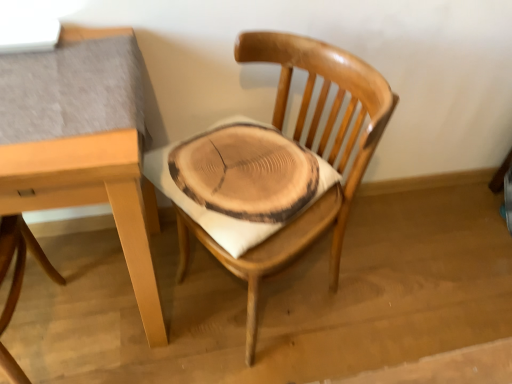
This screenshot has width=512, height=384. Describe the element at coordinates (274, 167) in the screenshot. I see `wooden chair at center, placed as the 1th chair when sorted from right to left` at that location.

This screenshot has width=512, height=384. What do you see at coordinates (19, 260) in the screenshot?
I see `natural wood chair at center, positioned as the second chair in right-to-left order` at bounding box center [19, 260].

The height and width of the screenshot is (384, 512). I want to click on wooden chair at center, placed as the 1th chair when sorted from right to left, so click(274, 167).

Is natural wood chair at center, positioned as the second chair in right-to-left order, smaller than light brown wood table at upper left?

Indeed, natural wood chair at center, positioned as the second chair in right-to-left order, has a smaller size compared to light brown wood table at upper left.

Do you think natural wood chair at center, positioned as the second chair in right-to-left order, is within light brown wood table at upper left, or outside of it?

The correct answer is: inside.

Which object is thinner, light brown wood table at upper left or natural wood chair at center, positioned as the second chair in right-to-left order?

natural wood chair at center, positioned as the second chair in right-to-left order.

Would you say light brown wood table at upper left contains natural wood chair at center, positioned as the second chair in right-to-left order?

Yes, light brown wood table at upper left contains natural wood chair at center, positioned as the second chair in right-to-left order.

In the scene shown: Considering the positions of objects light brown wood table at upper left and natural wood chair at center, positioned as the second chair in right-to-left order, in the image provided, who is more to the left, light brown wood table at upper left or natural wood chair at center, positioned as the second chair in right-to-left order,?

natural wood chair at center, positioned as the second chair in right-to-left order.

From the light brown wood table at upper left, count 1st chairs backward and point to it. Please provide its 2D coordinates.

[(19, 260)]

Which object is positioned more to the left, light brown wood table at upper left or wooden chair at center, which appears as the second chair when viewed from the left?

light brown wood table at upper left is more to the left.

Looking at this image, is light brown wood table at upper left facing towards wooden chair at center, placed as the 1th chair when sorted from right to left?

No, light brown wood table at upper left is not oriented towards wooden chair at center, placed as the 1th chair when sorted from right to left.

Do you think light brown wood table at upper left is within wooden chair at center, placed as the 1th chair when sorted from right to left, or outside of it?

light brown wood table at upper left cannot be found inside wooden chair at center, placed as the 1th chair when sorted from right to left.

Is light brown wood table at upper left in front of or behind wooden chair at center, which appears as the second chair when viewed from the left, in the image?

light brown wood table at upper left is in front of wooden chair at center, which appears as the second chair when viewed from the left.

Which object is thinner, wooden chair at center, which appears as the second chair when viewed from the left, or natural wood chair at center, which is the first chair from left to right?

natural wood chair at center, which is the first chair from left to right, is thinner.

Can you see wooden chair at center, which appears as the second chair when viewed from the left, touching natural wood chair at center, positioned as the second chair in right-to-left order?

No, wooden chair at center, which appears as the second chair when viewed from the left, is not touching natural wood chair at center, positioned as the second chair in right-to-left order.

Is wooden chair at center, placed as the 1th chair when sorted from right to left, to the left or to the right of natural wood chair at center, positioned as the second chair in right-to-left order, in the image?

wooden chair at center, placed as the 1th chair when sorted from right to left, is positioned on natural wood chair at center, positioned as the second chair in right-to-left order,'s right side.

Between wooden chair at center, which appears as the second chair when viewed from the left, and light brown wood table at upper left, which one has larger size?

light brown wood table at upper left is bigger.

From the image's perspective, relative to light brown wood table at upper left, is wooden chair at center, which appears as the second chair when viewed from the left, above or below?

wooden chair at center, which appears as the second chair when viewed from the left, is above light brown wood table at upper left.

Based on the photo, from a real-world perspective, is wooden chair at center, placed as the 1th chair when sorted from right to left, positioned above or below light brown wood table at upper left?

Clearly, from a real-world perspective, wooden chair at center, placed as the 1th chair when sorted from right to left, is above light brown wood table at upper left.

Considering the relative sizes of natural wood chair at center, which is the first chair from left to right, and wooden chair at center, which appears as the second chair when viewed from the left, in the image provided, is natural wood chair at center, which is the first chair from left to right, wider than wooden chair at center, which appears as the second chair when viewed from the left,?

In fact, natural wood chair at center, which is the first chair from left to right, might be narrower than wooden chair at center, which appears as the second chair when viewed from the left.

Is natural wood chair at center, positioned as the second chair in right-to-left order, turned away from wooden chair at center, placed as the 1th chair when sorted from right to left?

No, wooden chair at center, placed as the 1th chair when sorted from right to left, is not at the back of natural wood chair at center, positioned as the second chair in right-to-left order.

Is natural wood chair at center, which is the first chair from left to right, to the left or to the right of wooden chair at center, placed as the 1th chair when sorted from right to left, in the image?

natural wood chair at center, which is the first chair from left to right, is to the left of wooden chair at center, placed as the 1th chair when sorted from right to left.

In the scene shown: Looking at the image, does natural wood chair at center, which is the first chair from left to right, seem bigger or smaller compared to wooden chair at center, placed as the 1th chair when sorted from right to left?

Considering their sizes, natural wood chair at center, which is the first chair from left to right, takes up less space than wooden chair at center, placed as the 1th chair when sorted from right to left.

Identify the location of table on the right side of natural wood chair at center, which is the first chair from left to right. The image size is (512, 384). (93, 198).

The height and width of the screenshot is (384, 512). I want to click on table in front of the natural wood chair at center, positioned as the second chair in right-to-left order, so click(93, 198).

Which object lies further to the anchor point natural wood chair at center, positioned as the second chair in right-to-left order, wooden chair at center, which appears as the second chair when viewed from the left, or light brown wood table at upper left?

Among the two, wooden chair at center, which appears as the second chair when viewed from the left, is located further to natural wood chair at center, positioned as the second chair in right-to-left order.

Looking at the image, which one is located closer to wooden chair at center, which appears as the second chair when viewed from the left, light brown wood table at upper left or natural wood chair at center, which is the first chair from left to right?

light brown wood table at upper left is closer to wooden chair at center, which appears as the second chair when viewed from the left.

When comparing their distances from natural wood chair at center, which is the first chair from left to right, does light brown wood table at upper left or wooden chair at center, placed as the 1th chair when sorted from right to left, seem closer?

light brown wood table at upper left is closer to natural wood chair at center, which is the first chair from left to right.

Looking at the image, which one is located further to light brown wood table at upper left, wooden chair at center, which appears as the second chair when viewed from the left, or natural wood chair at center, positioned as the second chair in right-to-left order?

The object further to light brown wood table at upper left is wooden chair at center, which appears as the second chair when viewed from the left.

Looking at the image, which one is located closer to light brown wood table at upper left, natural wood chair at center, positioned as the second chair in right-to-left order, or wooden chair at center, which appears as the second chair when viewed from the left?

Based on the image, natural wood chair at center, positioned as the second chair in right-to-left order, appears to be nearer to light brown wood table at upper left.

Estimate the real-world distances between objects in this image. Which object is closer to wooden chair at center, placed as the 1th chair when sorted from right to left, natural wood chair at center, positioned as the second chair in right-to-left order, or light brown wood table at upper left?

light brown wood table at upper left is positioned closer to the anchor wooden chair at center, placed as the 1th chair when sorted from right to left.

Locate an element on the screen. The image size is (512, 384). table between natural wood chair at center, which is the first chair from left to right, and wooden chair at center, which appears as the second chair when viewed from the left, in the horizontal direction is located at coordinates pyautogui.click(x=93, y=198).